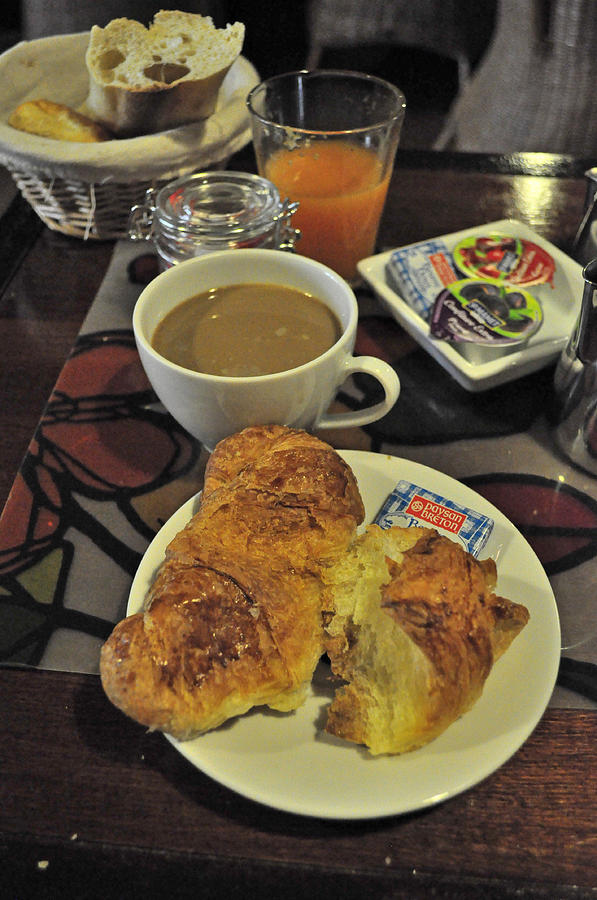
You are a GUI agent. You are given a task and a screenshot of the screen. Output one action in this format:
    pyautogui.click(x=<x>, y=<y>)
    Task: Click on the small white mug with coffee
    The width and height of the screenshot is (597, 900).
    Given the screenshot: What is the action you would take?
    pyautogui.click(x=276, y=384), pyautogui.click(x=251, y=342)